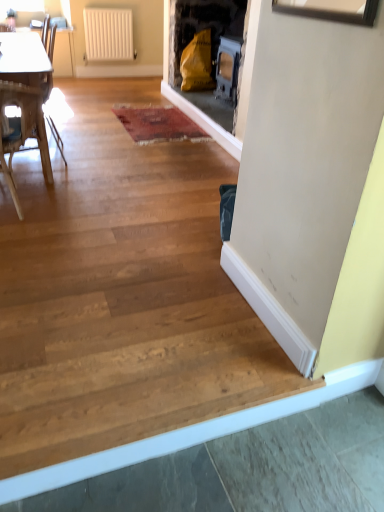
This screenshot has width=384, height=512. I want to click on vacant area in front of wooden chair at left, so click(36, 233).